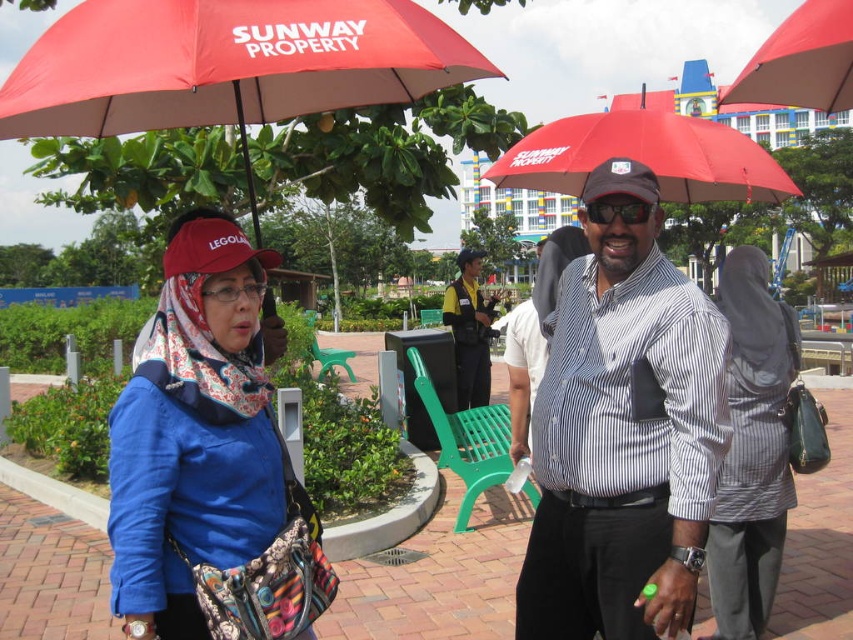
What are the coordinates of `matte blue shirt at center` in the screenshot? It's located at (195, 432).

Does matte blue shirt at center have a greater height compared to red matte umbrella at upper center?

Correct, matte blue shirt at center is much taller as red matte umbrella at upper center.

Is point (274, 522) closer to viewer compared to point (805, 33)?

Yes, point (274, 522) is closer to viewer.

Where is `matte blue shirt at center`? Image resolution: width=853 pixels, height=640 pixels. matte blue shirt at center is located at coordinates (195, 432).

Which is more to the right, matte blue shirt at center or yellow uniform at center?

From the viewer's perspective, yellow uniform at center appears more on the right side.

Locate an element on the screen. matte blue shirt at center is located at coordinates (195, 432).

Locate an element on the screen. This screenshot has width=853, height=640. matte blue shirt at center is located at coordinates (195, 432).

Does striped cotton shirt at center appear under red matte umbrella at upper left?

Indeed, striped cotton shirt at center is positioned under red matte umbrella at upper left.

Does point (589, 275) come behind point (230, 168)?

No, it is not.

Locate an element on the screen. The width and height of the screenshot is (853, 640). striped cotton shirt at center is located at coordinates (624, 429).